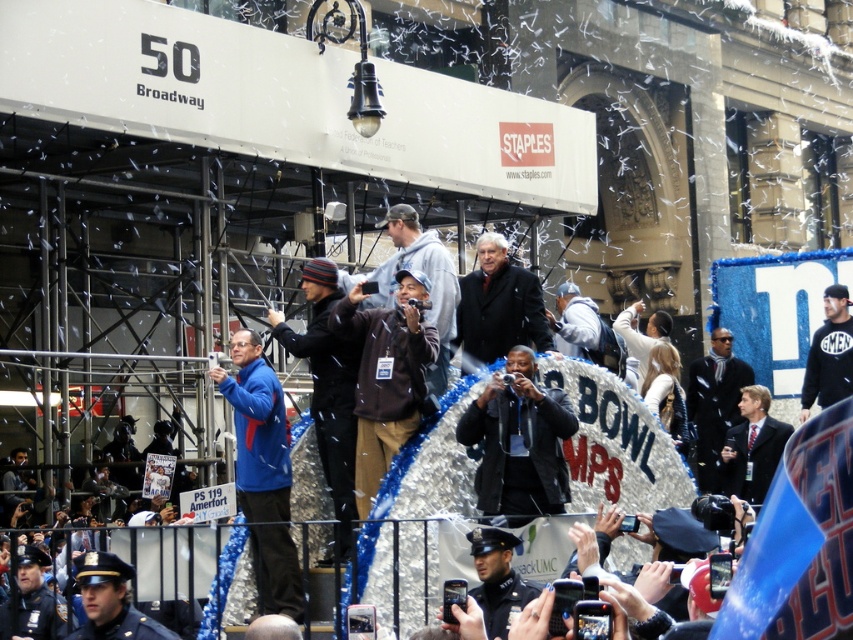
Question: Does blue fabric jacket at center appear on the right side of white cotton shirt at center?

Choices:
 (A) no
 (B) yes

Answer: (A)

Question: Estimate the real-world distances between objects in this image. Which object is closer to the uniformed officer at lower left?

Choices:
 (A) brown leather jacket at center
 (B) dark gray suit at center
 (C) dark gray hoodie at center
 (D) dark blue sweatshirt at center

Answer: (A)

Question: Can you confirm if black leather jacket at center is positioned to the left of dark blue knit hat at center?

Choices:
 (A) yes
 (B) no

Answer: (B)

Question: Among these points, which one is nearest to the camera?

Choices:
 (A) (18, 576)
 (B) (512, 518)
 (C) (444, 248)
 (D) (635, 342)

Answer: (B)

Question: Which point is farther from the camera taking this photo?

Choices:
 (A) (469, 310)
 (B) (474, 484)
 (C) (403, 259)
 (D) (634, 355)

Answer: (D)

Question: Does blue fabric jacket at center appear on the left side of black leather jacket at center?

Choices:
 (A) yes
 (B) no

Answer: (A)